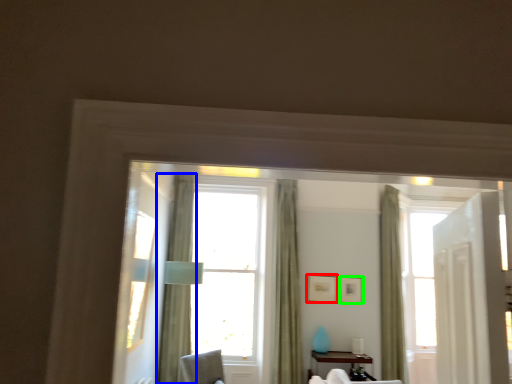
Question: Which object is positioned farthest from picture frame (highlighted by a red box)? Select from curtain (highlighted by a blue box) and picture frame (highlighted by a green box).

Choices:
 (A) curtain
 (B) picture frame

Answer: (A)